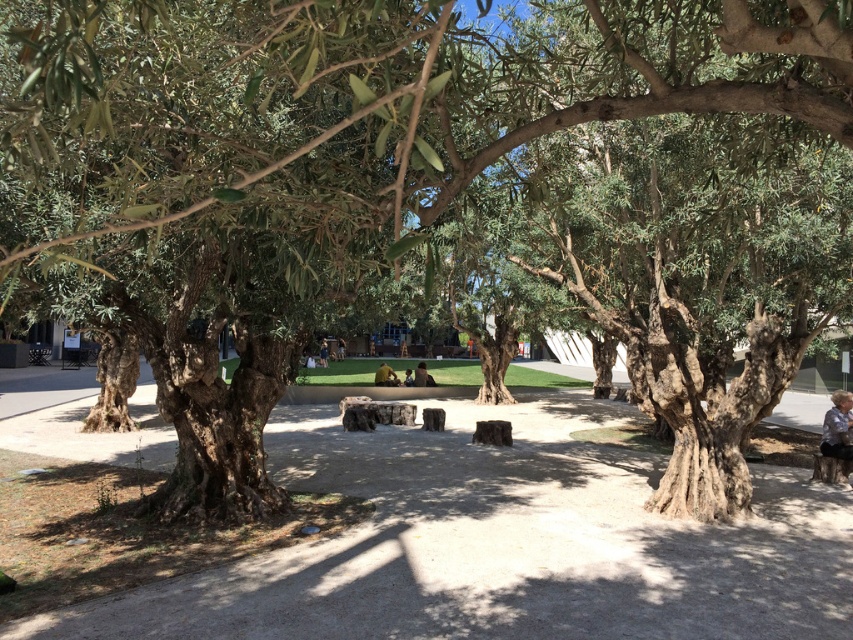
Consider the image. You are standing in the park and see the blue denim shirt at lower right and the yellow fabric person at center. Which one is taller?

The blue denim shirt at lower right is taller than the yellow fabric person at center.